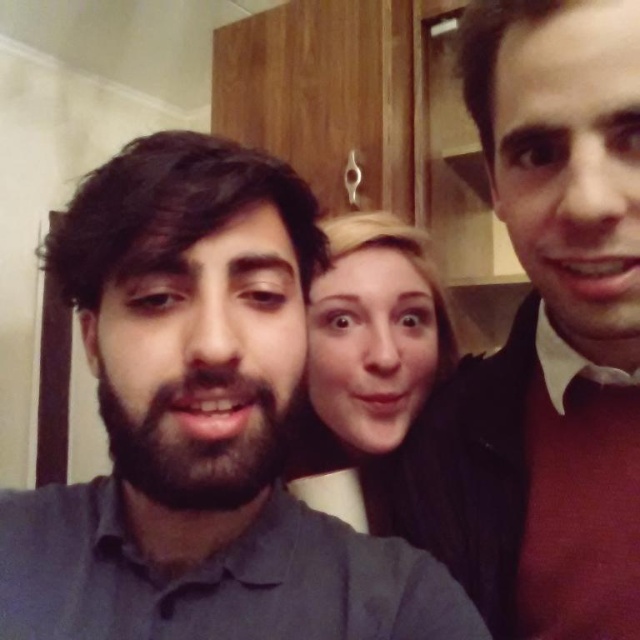
You are holding a 12 inch ruler and want to measure the distance between yourself and the point at coordinates point (256, 557) in the image. Can you reach it with your ruler?

The distance between you and the point at coordinates point (256, 557) is 17.07 inches, so yes, you can reach it with your 12 inch ruler since it is shorter than the ruler length.